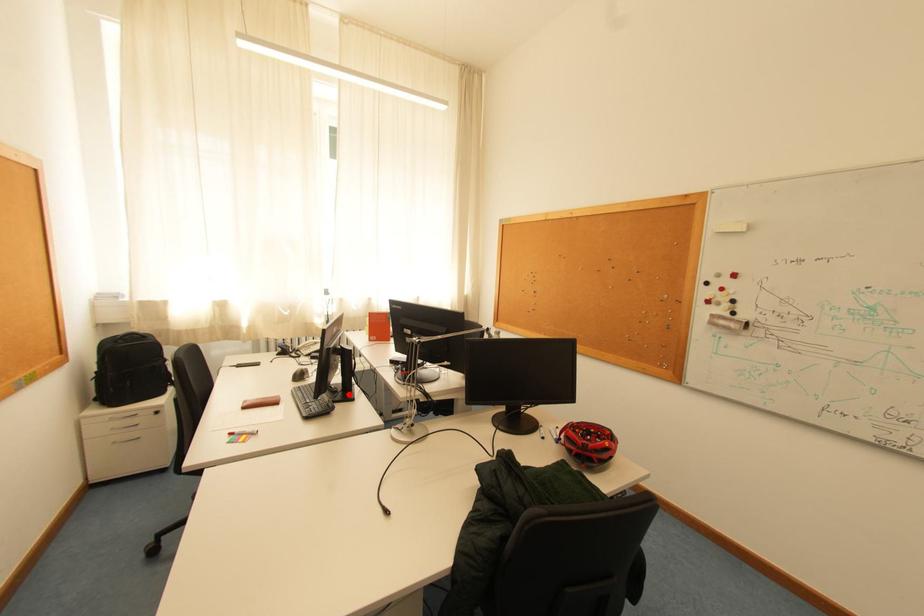
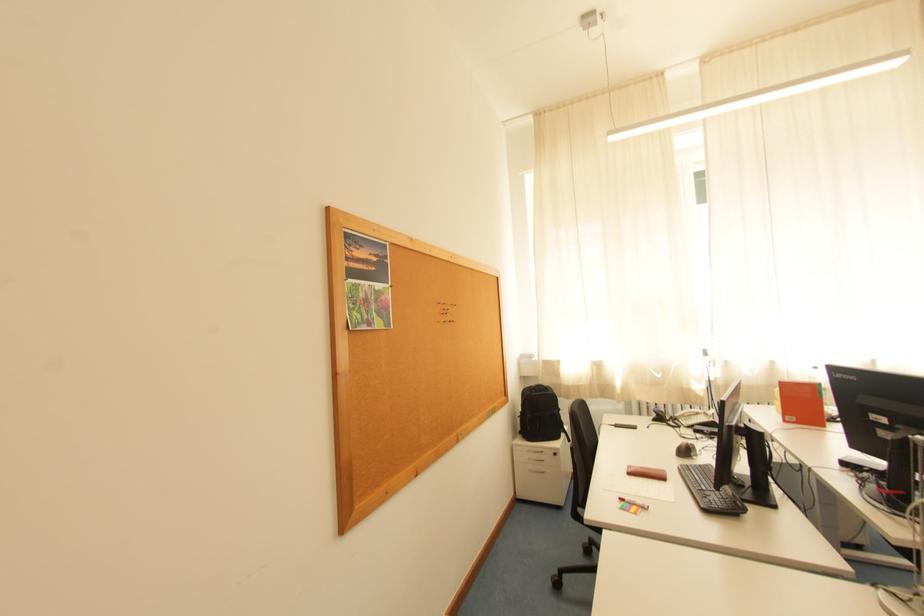
Find the pixel in the second image that matches the highlighted location in the first image.

(759, 492)